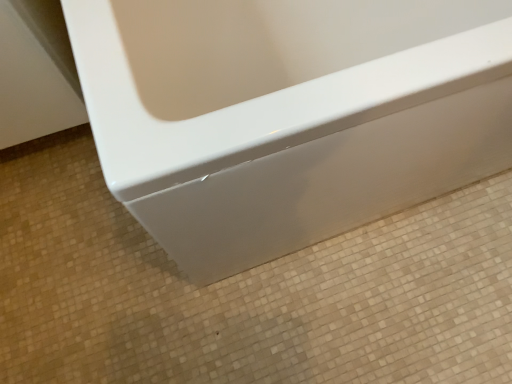
Question: Based on their positions, is white glossy bathtub at center located to the left or right of glossy white bathtub at center?

Choices:
 (A) left
 (B) right

Answer: (A)

Question: From a real-world perspective, is white glossy bathtub at center positioned above or below glossy white bathtub at center?

Choices:
 (A) below
 (B) above

Answer: (A)

Question: Which is correct: white glossy bathtub at center is inside glossy white bathtub at center, or outside of it?

Choices:
 (A) inside
 (B) outside

Answer: (B)

Question: In terms of height, does glossy white bathtub at center look taller or shorter compared to white glossy bathtub at center?

Choices:
 (A) tall
 (B) short

Answer: (A)

Question: Does point (181, 62) appear closer or farther from the camera than point (1, 256)?

Choices:
 (A) closer
 (B) farther

Answer: (A)

Question: From the image's perspective, relative to white glossy bathtub at center, is glossy white bathtub at center above or below?

Choices:
 (A) above
 (B) below

Answer: (A)

Question: In terms of size, does glossy white bathtub at center appear bigger or smaller than white glossy bathtub at center?

Choices:
 (A) small
 (B) big

Answer: (B)